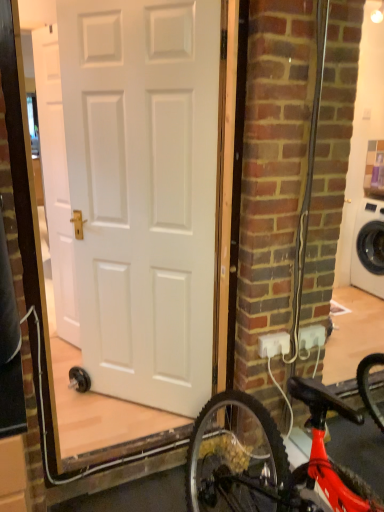
Question: Is white matte door at center, the second door in the left-to-right sequence, bigger than white matte door at upper left, which is the second door in front-to-back order?

Choices:
 (A) yes
 (B) no

Answer: (A)

Question: Can you confirm if white matte door at center, positioned as the second door in back-to-front order, is thinner than white matte door at upper left, which ranks as the 1th door in left-to-right order?

Choices:
 (A) yes
 (B) no

Answer: (B)

Question: Is white matte door at center, which is counted as the 1th door, starting from the right, further to the viewer compared to white matte door at upper left, which is counted as the 1th door, starting from the back?

Choices:
 (A) yes
 (B) no

Answer: (B)

Question: Is white matte door at upper left, which is the second door in front-to-back order, surrounded by white matte door at center, which is counted as the 1th door, starting from the right?

Choices:
 (A) no
 (B) yes

Answer: (A)

Question: Is white matte door at center, which is counted as the 1th door, starting from the right, with white matte door at upper left, which is the second door in front-to-back order?

Choices:
 (A) yes
 (B) no

Answer: (B)

Question: Is white plastic outlet at lower right spatially inside white matte door at center, the first door positioned from the front, or outside of it?

Choices:
 (A) outside
 (B) inside

Answer: (A)

Question: From their relative heights in the image, would you say white plastic outlet at lower right is taller or shorter than white matte door at center, which is counted as the 1th door, starting from the right?

Choices:
 (A) short
 (B) tall

Answer: (A)

Question: From the image's perspective, is white plastic outlet at lower right located above or below white matte door at center, the second door in the left-to-right sequence?

Choices:
 (A) above
 (B) below

Answer: (B)

Question: Visually, is white plastic outlet at lower right positioned to the left or to the right of white matte door at center, positioned as the second door in back-to-front order?

Choices:
 (A) right
 (B) left

Answer: (A)

Question: Considering the positions of white plastic outlet at lower right and white matte door at upper left, which is counted as the 1th door, starting from the back, in the image, is white plastic outlet at lower right wider or thinner than white matte door at upper left, which is counted as the 1th door, starting from the back,?

Choices:
 (A) thin
 (B) wide

Answer: (A)

Question: Is white plastic outlet at lower right inside the boundaries of white matte door at upper left, acting as the 2th door starting from the right, or outside?

Choices:
 (A) outside
 (B) inside

Answer: (A)

Question: From a real-world perspective, relative to white matte door at upper left, acting as the 2th door starting from the right, is white plastic outlet at lower right vertically above or below?

Choices:
 (A) below
 (B) above

Answer: (A)

Question: Is white plastic outlet at lower right bigger or smaller than white matte door at upper left, which is counted as the 1th door, starting from the back?

Choices:
 (A) big
 (B) small

Answer: (B)

Question: Is shiny red bicycle at lower right wider or thinner than white matte door at center, which is counted as the 1th door, starting from the right?

Choices:
 (A) thin
 (B) wide

Answer: (B)

Question: Relative to white matte door at center, positioned as the second door in back-to-front order, is shiny red bicycle at lower right in front or behind?

Choices:
 (A) front
 (B) behind

Answer: (A)